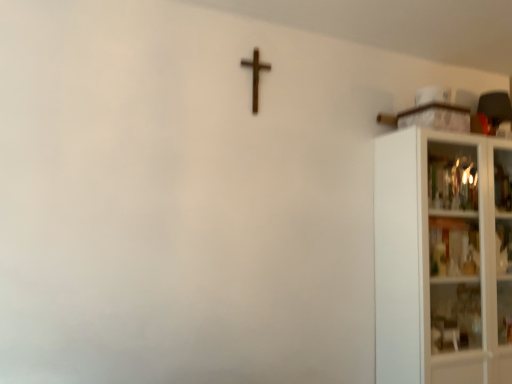
This screenshot has width=512, height=384. What do you see at coordinates (443, 257) in the screenshot?
I see `white glass cabinet at right` at bounding box center [443, 257].

I want to click on white glass cabinet at right, so click(443, 257).

The width and height of the screenshot is (512, 384). What do you see at coordinates (255, 75) in the screenshot? I see `wooden cross at upper center` at bounding box center [255, 75].

I want to click on wooden cross at upper center, so click(255, 75).

Measure the distance between point (x=243, y=64) and camera.

A distance of 1.86 meters exists between point (x=243, y=64) and camera.

Find the location of a particular element. white glass cabinet at right is located at coordinates (443, 257).

Looking at this image, visually, is white glass cabinet at right positioned to the left or to the right of wooden cross at upper center?

In the image, white glass cabinet at right appears on the right side of wooden cross at upper center.

Considering the relative positions of white glass cabinet at right and wooden cross at upper center in the image provided, is white glass cabinet at right behind wooden cross at upper center?

No, white glass cabinet at right is in front of wooden cross at upper center.

Considering the points (435, 268) and (256, 66), which point is behind, point (435, 268) or point (256, 66)?

Positioned behind is point (435, 268).

In the scene shown: From the image's perspective, is white glass cabinet at right positioned above or below wooden cross at upper center?

Clearly, from the image's perspective, white glass cabinet at right is below wooden cross at upper center.

From a real-world perspective, between white glass cabinet at right and wooden cross at upper center, who is vertically higher?

From a 3D spatial view, wooden cross at upper center is above.

Considering the sizes of objects white glass cabinet at right and wooden cross at upper center in the image provided, who is wider, white glass cabinet at right or wooden cross at upper center?

With larger width is white glass cabinet at right.

In the scene shown: Considering the relative sizes of white glass cabinet at right and wooden cross at upper center in the image provided, is white glass cabinet at right taller than wooden cross at upper center?

Yes, white glass cabinet at right is taller than wooden cross at upper center.

Which of these two, white glass cabinet at right or wooden cross at upper center, is smaller?

With smaller size is wooden cross at upper center.

Which is correct: white glass cabinet at right is inside wooden cross at upper center, or outside of it?

white glass cabinet at right lies outside wooden cross at upper center.

Is white glass cabinet at right far away from wooden cross at upper center?

Absolutely, white glass cabinet at right is distant from wooden cross at upper center.

Is white glass cabinet at right looking in the opposite direction of wooden cross at upper center?

No, white glass cabinet at right's orientation is not away from wooden cross at upper center.

How many degrees apart are the facing directions of white glass cabinet at right and wooden cross at upper center?

The facing directions of white glass cabinet at right and wooden cross at upper center are 3.15 degrees apart.

Where is `shelf on the right of wooden cross at upper center`? This screenshot has width=512, height=384. shelf on the right of wooden cross at upper center is located at coordinates coord(443,257).

Which is more to the right, wooden cross at upper center or white glass cabinet at right?

Positioned to the right is white glass cabinet at right.

In the image, is wooden cross at upper center positioned in front of or behind white glass cabinet at right?

wooden cross at upper center is behind white glass cabinet at right.

Is point (256, 50) positioned behind point (479, 226)?

That is False.

From the picture: From the image's perspective, between wooden cross at upper center and white glass cabinet at right, which one is located above?

From the image's view, wooden cross at upper center is above.

From a real-world perspective, is wooden cross at upper center located beneath white glass cabinet at right?

No, from a real-world perspective, wooden cross at upper center is not below white glass cabinet at right.

Does wooden cross at upper center have a greater width compared to white glass cabinet at right?

Incorrect, the width of wooden cross at upper center does not surpass that of white glass cabinet at right.

From the picture: Considering the sizes of objects wooden cross at upper center and white glass cabinet at right in the image provided, who is taller, wooden cross at upper center or white glass cabinet at right?

Standing taller between the two is white glass cabinet at right.

Which of these two, wooden cross at upper center or white glass cabinet at right, is bigger?

With larger size is white glass cabinet at right.

Is wooden cross at upper center not within white glass cabinet at right?

Yes, wooden cross at upper center is located beyond the bounds of white glass cabinet at right.

Is wooden cross at upper center positioned far away from white glass cabinet at right?

Yes, wooden cross at upper center and white glass cabinet at right are quite far apart.

Is wooden cross at upper center facing away from white glass cabinet at right?

No, white glass cabinet at right is not at the back of wooden cross at upper center.

How much distance is there between wooden cross at upper center and white glass cabinet at right?

wooden cross at upper center is 1.09 meters away from white glass cabinet at right.

This screenshot has height=384, width=512. Identify the location of shelf located underneath the wooden cross at upper center (from a real-world perspective). (443, 257).

Locate an element on the screen. The width and height of the screenshot is (512, 384). shelf on the right side of wooden cross at upper center is located at coordinates (443, 257).

This screenshot has width=512, height=384. I want to click on shelf in front of the wooden cross at upper center, so click(x=443, y=257).